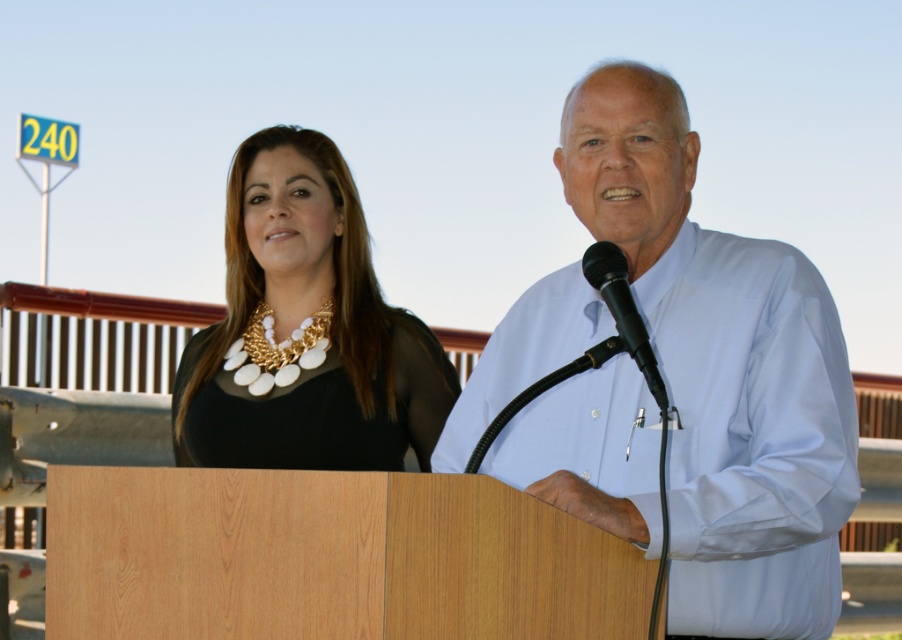
Measure the distance between point (723, 524) and camera.

A distance of 7.65 feet exists between point (723, 524) and camera.

The width and height of the screenshot is (902, 640). Find the location of `light blue shirt at center`. light blue shirt at center is located at coordinates (723, 371).

Is black matte necklace at upper left thinner than black matte microphone at center?

In fact, black matte necklace at upper left might be wider than black matte microphone at center.

Can you confirm if black matte necklace at upper left is positioned to the right of black matte microphone at center?

No, black matte necklace at upper left is not to the right of black matte microphone at center.

Is point (382, 364) farther from camera compared to point (597, 284)?

Yes, it is behind point (597, 284).

The image size is (902, 640). What are the coordinates of `black matte necklace at upper left` in the screenshot? It's located at 306,330.

Can you confirm if light blue shirt at center is positioned to the left of black matte necklace at upper left?

In fact, light blue shirt at center is to the right of black matte necklace at upper left.

Is light blue shirt at center taller than black matte necklace at upper left?

Yes.

The image size is (902, 640). I want to click on light blue shirt at center, so click(x=723, y=371).